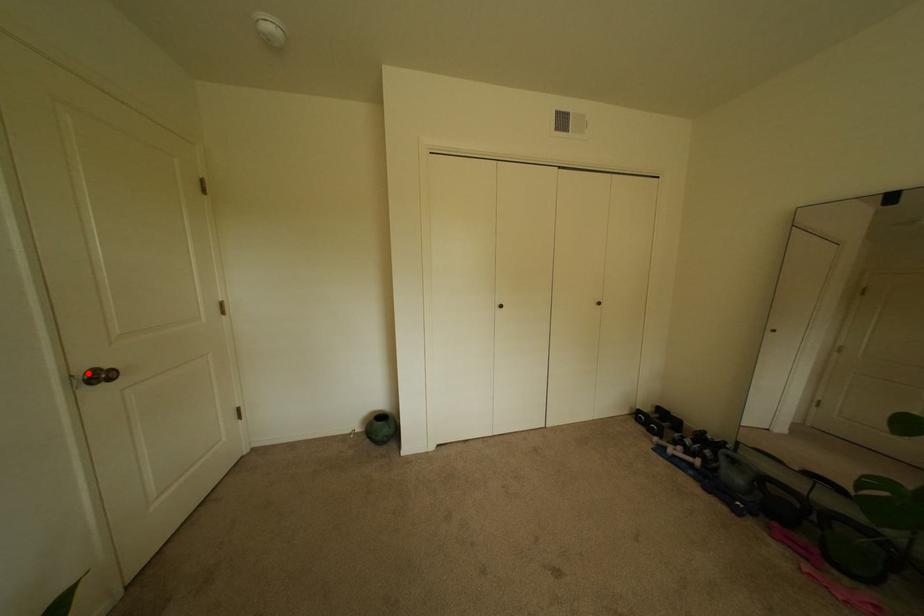
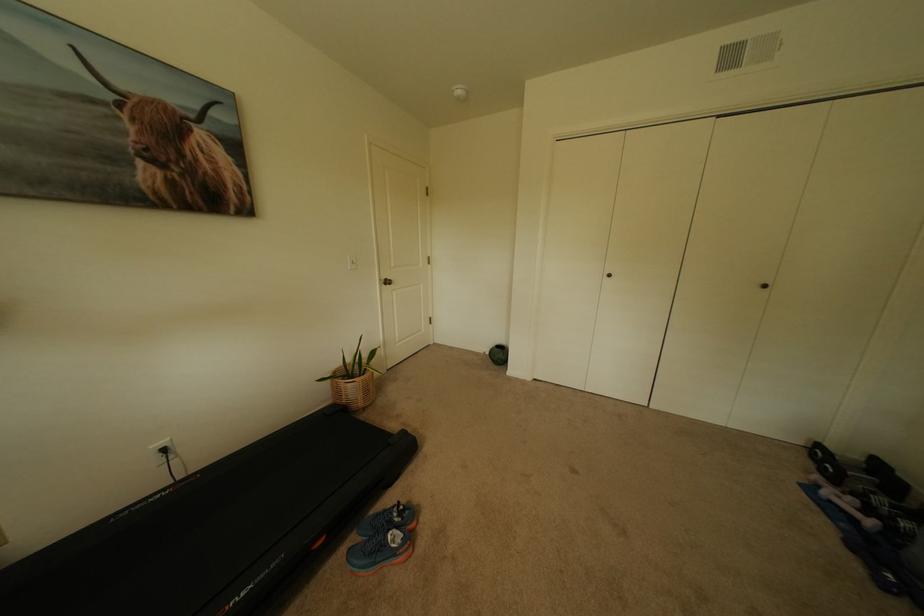
Locate, in the second image, the point that corresponds to the highlighted location in the first image.

(391, 280)